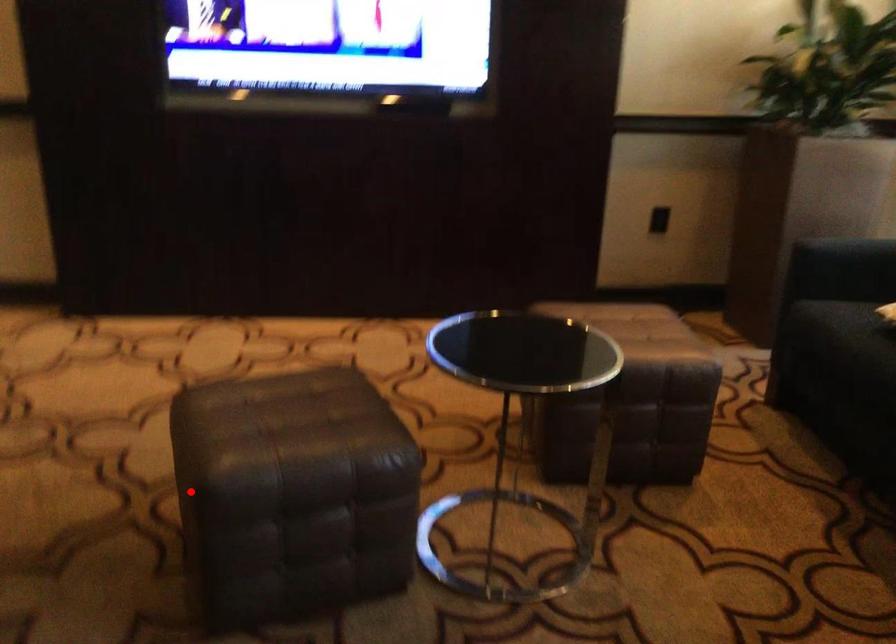
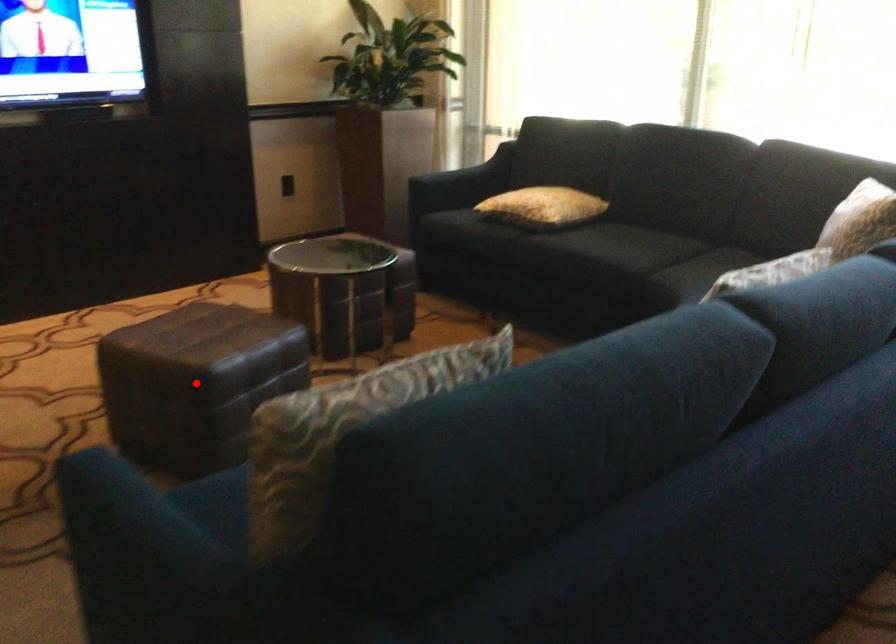
I am providing you with two images of the same scene from different viewpoints. A red point is marked on the first image and another point is marked on the second image. Do the highlighted points in image1 and image2 indicate the same real-world spot?

Yes